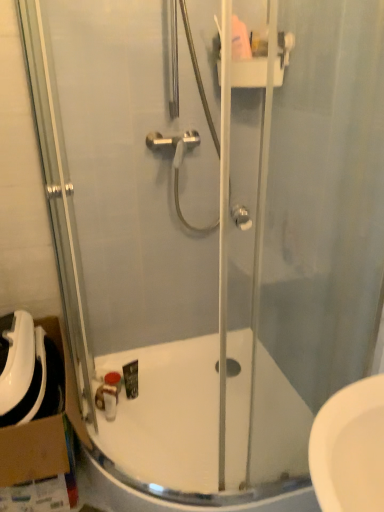
Question: From their relative heights in the image, would you say white glossy bath at center is taller or shorter than cardboard at left?

Choices:
 (A) tall
 (B) short

Answer: (B)

Question: Is white glossy bath at center in front of or behind cardboard at left in the image?

Choices:
 (A) behind
 (B) front

Answer: (B)

Question: Estimate the real-world distances between objects in this image. Which object is farther from the matte brown soap at lower center?

Choices:
 (A) cardboard at left
 (B) white glossy bath at center

Answer: (B)

Question: Which is nearer to the cardboard at left?

Choices:
 (A) matte brown soap at lower center
 (B) white glossy bath at center

Answer: (A)